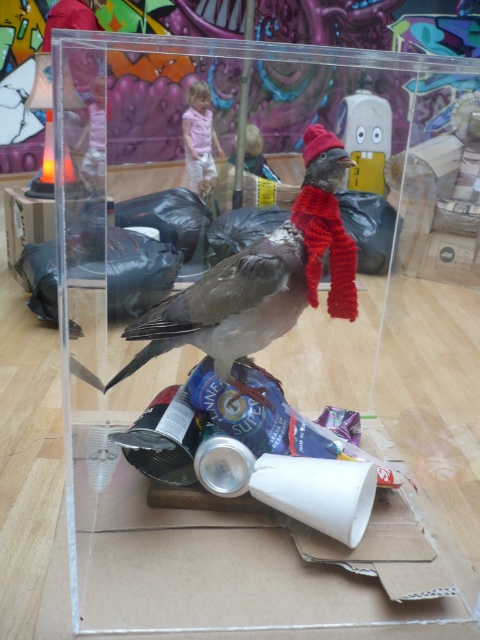
You are standing in front of the acrylic box with the pigeon. There are two points marked inside the box. The first point is at coordinates point (x=155, y=336) and the second is at point (x=364, y=116). Which point is nearer to you?

Point (x=155, y=336) is closer to the camera than point (x=364, y=116), so the first point is nearer to you.

You are a delivery robot navigating a warehouse. Your current position is at coordinates 0.4, 0.5. You need to deliver a package to the matte gray bird at center. What direction should you move in to reach it?

The matte gray bird at center is located at coordinates (263, 278). Since your current position is at (240, 256), you should move northeast to reach it.

You are a delivery person who needs to place a 30 inch long package between the matte gray bird at center and the nearest wall. Can you fit the package in that space?

The space between the matte gray bird at center and the nearest wall is 30.87 inches, so yes, the 30 inch long package can fit in that space since it is slightly shorter than the available space.